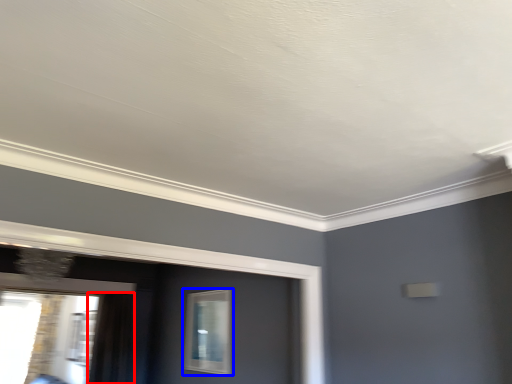
Question: Among these objects, which one is nearest to the camera, curtain (highlighted by a red box) or window (highlighted by a blue box)?

Choices:
 (A) curtain
 (B) window

Answer: (B)